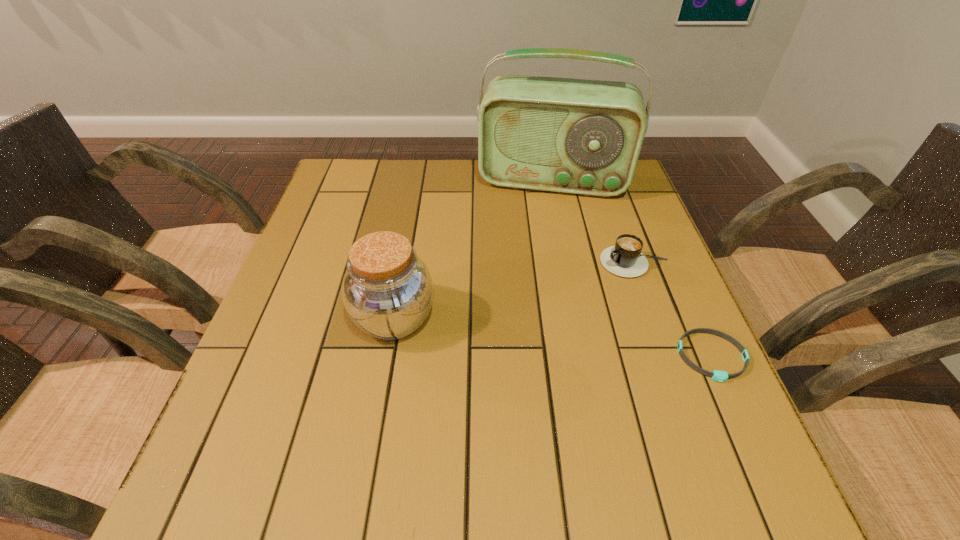
In the image, there is a desktop. Identify the location of free space at the far edge. This screenshot has width=960, height=540. (400, 164).

Identify the location of vacant area at the near edge of the desktop. (447, 410).

At what (x,y) coordinates should I click in order to perform the action: click on blank space at the left edge of the desktop. Please return your answer as a coordinate pair (x, y). Looking at the image, I should click on (295, 296).

In the image, there is a desktop. Where is `vacant space at the right edge`? The image size is (960, 540). vacant space at the right edge is located at coordinates (662, 311).

In order to click on vacant space that's between the radio receiver and the cappuccino in this screenshot , I will do click(593, 221).

You are a GUI agent. You are given a task and a screenshot of the screen. Output one action in this format:
    pyautogui.click(x=<x>, y=<y>)
    Task: Click on the free space that is in between the shortest object and the jar
    This screenshot has height=540, width=960.
    Given the screenshot: What is the action you would take?
    pyautogui.click(x=553, y=338)

Find the location of a particular element. The image size is (960, 540). free spot between the third nearest object and the shortest object is located at coordinates (673, 310).

Locate an element on the screen. This screenshot has height=540, width=960. blank region between the jar and the radio receiver is located at coordinates (473, 249).

Where is `free space between the cappuccino and the leftmost object`? free space between the cappuccino and the leftmost object is located at coordinates (x=515, y=291).

Locate an element on the screen. The width and height of the screenshot is (960, 540). unoccupied area between the radio receiver and the second farthest object is located at coordinates (593, 221).